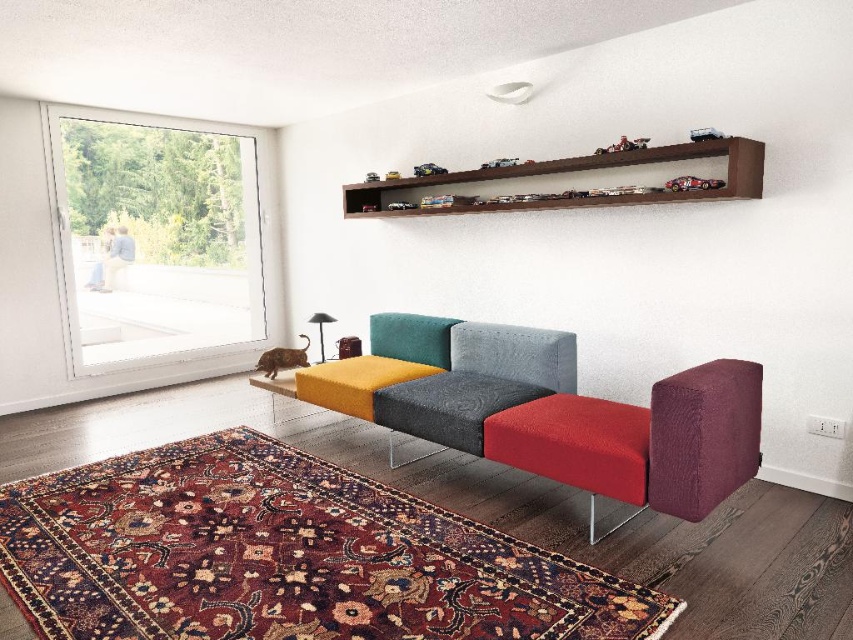
Question: Does transparent glass door at left have a greater width compared to wooden shelf at upper center?

Choices:
 (A) no
 (B) yes

Answer: (A)

Question: Which of the following is the farthest from the observer?

Choices:
 (A) wooden shelf at upper center
 (B) transparent glass door at left

Answer: (B)

Question: Where is transparent glass door at left located in relation to wooden shelf at upper center in the image?

Choices:
 (A) above
 (B) below

Answer: (B)

Question: Observing the image, what is the correct spatial positioning of transparent glass door at left in reference to wooden shelf at upper center?

Choices:
 (A) below
 (B) above

Answer: (A)

Question: Which point appears closest to the camera in this image?

Choices:
 (A) (428, 193)
 (B) (109, 120)

Answer: (A)

Question: Which point appears closest to the camera in this image?

Choices:
 (A) (222, 179)
 (B) (730, 186)

Answer: (B)